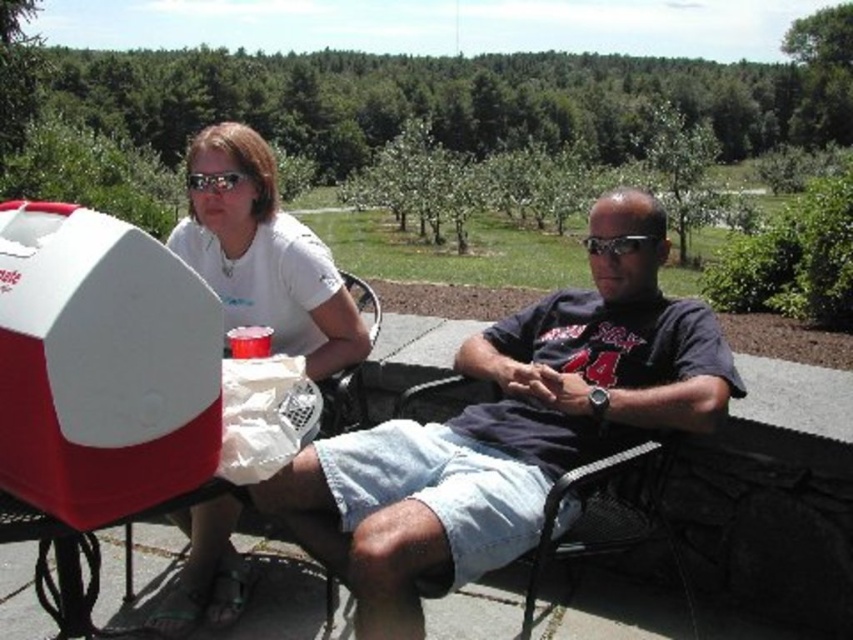
You are planning to place a small plant pot between the denim shorts at center and the large red and white cooler. According to their positions, which object is closer to the center of the image? Please name the object.

The denim shorts at center is located at point (509, 429), which is closer to the center of the image compared to the large red and white cooler. Therefore, the denim shorts at center is closer.